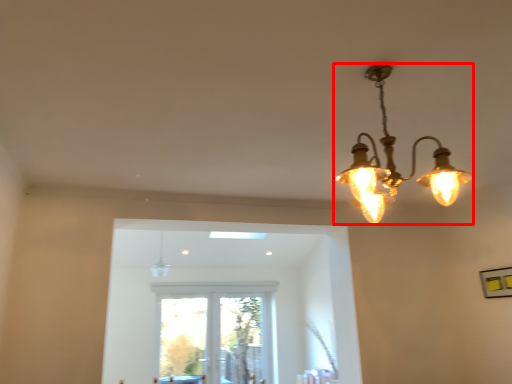
Question: From the image's perspective, considering the relative positions of lamp (annotated by the red box) and lamp in the image provided, where is lamp (annotated by the red box) located with respect to the staircase?

Choices:
 (A) above
 (B) below

Answer: (A)